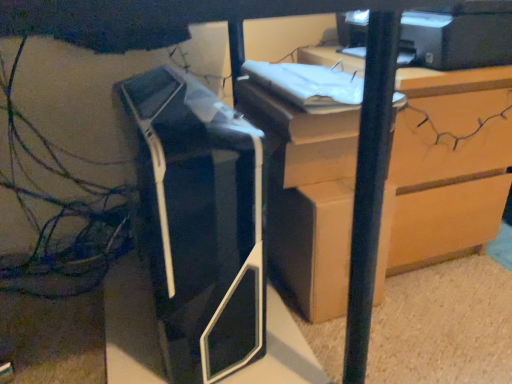
Question: Should I look upward or downward to see black plastic printer at center, arranged as the 2th printer when viewed from the top?

Choices:
 (A) down
 (B) up

Answer: (A)

Question: Should I look upward or downward to see matte black printer at upper right, the 2th printer positioned from the bottom?

Choices:
 (A) up
 (B) down

Answer: (A)

Question: Is matte black printer at upper right, which is the 1th printer from top to bottom, wider than wooden chest of drawers at upper right?

Choices:
 (A) no
 (B) yes

Answer: (A)

Question: Does matte black printer at upper right, arranged as the 1th printer when viewed from the right, come behind wooden chest of drawers at upper right?

Choices:
 (A) no
 (B) yes

Answer: (A)

Question: From the image's perspective, is matte black printer at upper right, marked as the second printer in a left-to-right arrangement, under wooden chest of drawers at upper right?

Choices:
 (A) no
 (B) yes

Answer: (A)

Question: From a real-world perspective, does matte black printer at upper right, the 2th printer positioned from the bottom, sit lower than wooden chest of drawers at upper right?

Choices:
 (A) yes
 (B) no

Answer: (B)

Question: Is wooden chest of drawers at upper right a part of matte black printer at upper right, arranged as the 1th printer when viewed from the right?

Choices:
 (A) yes
 (B) no

Answer: (B)

Question: Is matte black printer at upper right, the 2th printer positioned from the bottom, shorter than wooden chest of drawers at upper right?

Choices:
 (A) yes
 (B) no

Answer: (A)

Question: Can you confirm if black plastic printer at center, the second printer when ordered from right to left, is positioned to the left of matte cardboard box at center?

Choices:
 (A) yes
 (B) no

Answer: (A)

Question: Considering the relative positions of black plastic printer at center, marked as the first printer in a bottom-to-top arrangement, and matte cardboard box at center in the image provided, is black plastic printer at center, marked as the first printer in a bottom-to-top arrangement, to the right of matte cardboard box at center from the viewer's perspective?

Choices:
 (A) no
 (B) yes

Answer: (A)

Question: Is black plastic printer at center, marked as the first printer in a bottom-to-top arrangement, shorter than matte cardboard box at center?

Choices:
 (A) no
 (B) yes

Answer: (A)

Question: Would you say matte cardboard box at center is part of black plastic printer at center, marked as the first printer in a bottom-to-top arrangement,'s contents?

Choices:
 (A) yes
 (B) no

Answer: (B)

Question: From a real-world perspective, does black plastic printer at center, the second printer when ordered from right to left, sit lower than matte cardboard box at center?

Choices:
 (A) yes
 (B) no

Answer: (B)

Question: Does wooden chest of drawers at upper right have a greater height compared to matte cardboard box at center?

Choices:
 (A) yes
 (B) no

Answer: (A)